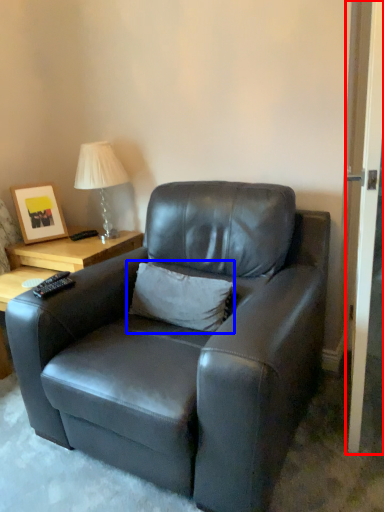
Question: Which of the following is the closest to the observer, screen door (highlighted by a red box) or pillow (highlighted by a blue box)?

Choices:
 (A) screen door
 (B) pillow

Answer: (A)